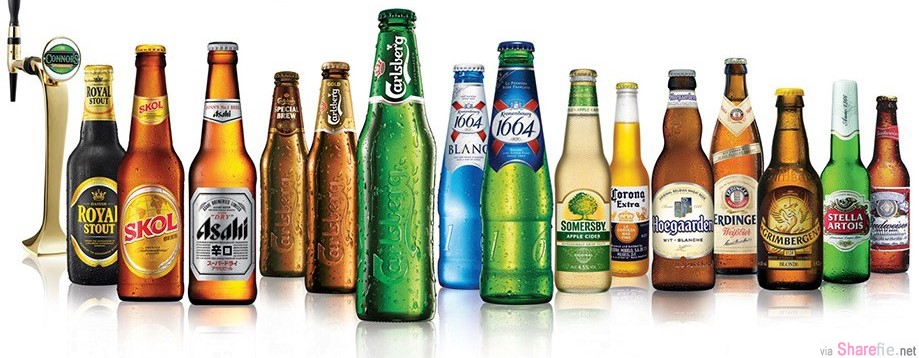
Image resolution: width=919 pixels, height=358 pixels. What are the coordinates of `bottles with large labels` in the screenshot? It's located at (104, 218), (156, 221), (224, 226), (576, 233), (621, 218), (678, 224), (734, 211), (789, 223), (844, 218), (892, 224).